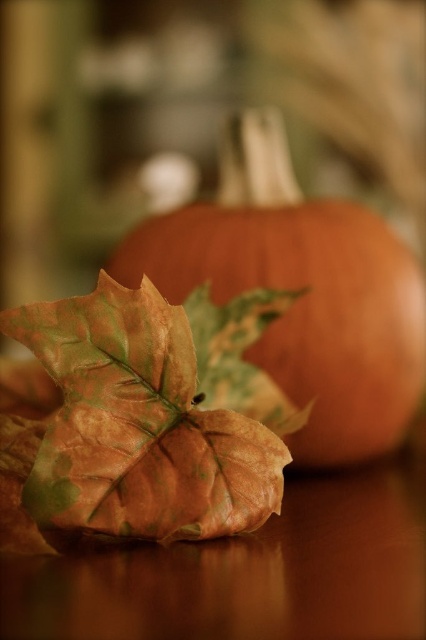
Question: Does leathery brown leaf at lower left have a greater width compared to matte orange pumpkin at center?

Choices:
 (A) yes
 (B) no

Answer: (B)

Question: Which of the following is the closest to the observer?

Choices:
 (A) (344, 221)
 (B) (103, 515)

Answer: (B)

Question: Is leathery brown leaf at lower left to the right of matte orange pumpkin at center from the viewer's perspective?

Choices:
 (A) yes
 (B) no

Answer: (B)

Question: Among these points, which one is farthest from the camera?

Choices:
 (A) (307, 276)
 (B) (71, 336)

Answer: (A)

Question: Does leathery brown leaf at lower left appear on the right side of matte orange pumpkin at center?

Choices:
 (A) yes
 (B) no

Answer: (B)